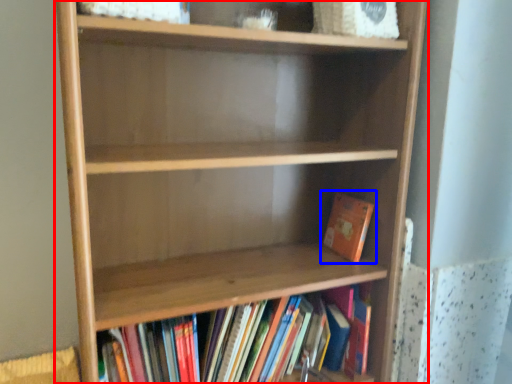
Question: Among these objects, which one is nearest to the camera, shelf (highlighted by a red box) or book (highlighted by a blue box)?

Choices:
 (A) shelf
 (B) book

Answer: (A)